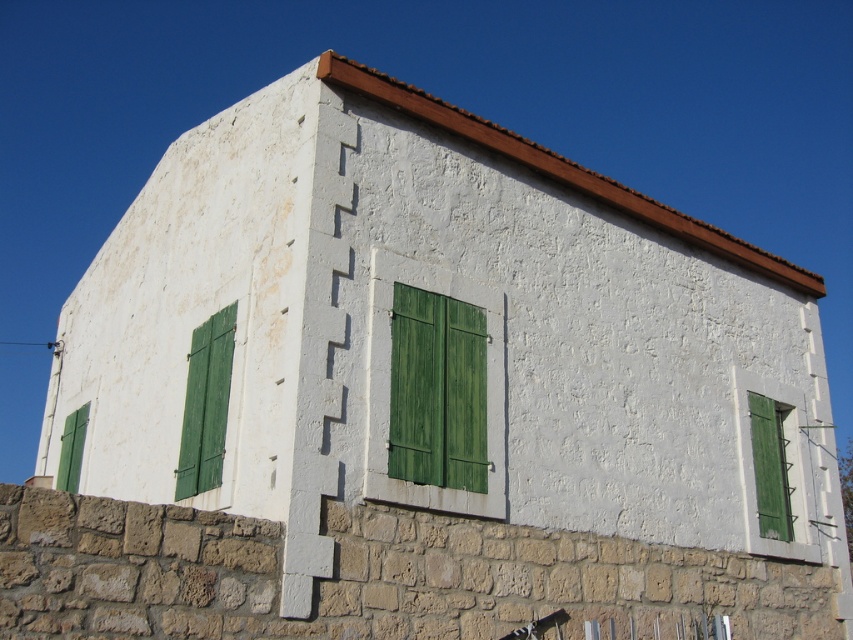
You are standing in front of the building and notice two green matte shutters. The first is labeled as green matte shutters at left and the second as green matte shutter at lower left. Which of these two shutters is closer to you?

The green matte shutters at left is in front of the green matte shutter at lower left, so the green matte shutters at left is closer to you.

You are an architect reviewing a design drawing of a building with green matte shutters at left and green matte window at right. According to the design, which object is positioned higher on the building?

The green matte shutters at left is positioned higher than the green matte window at right.